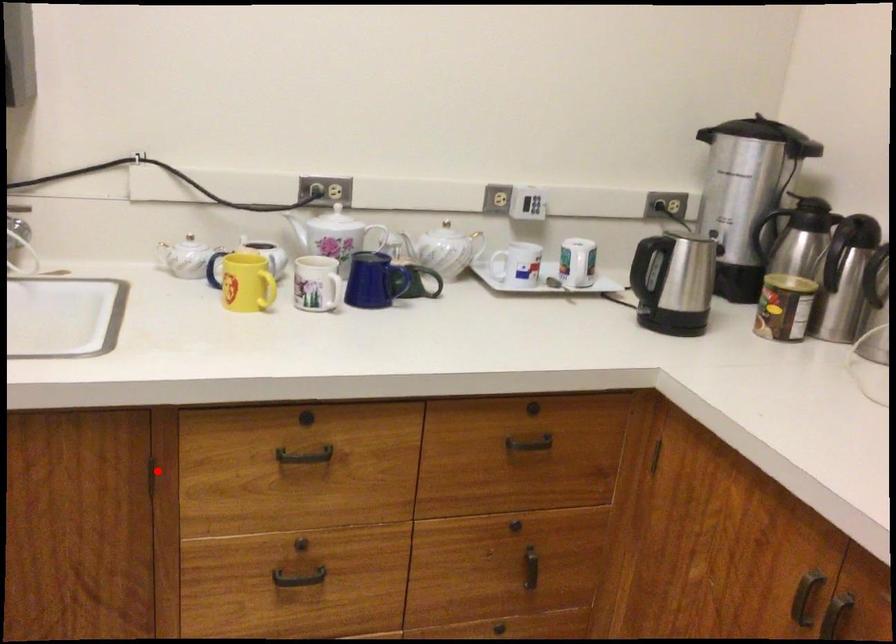
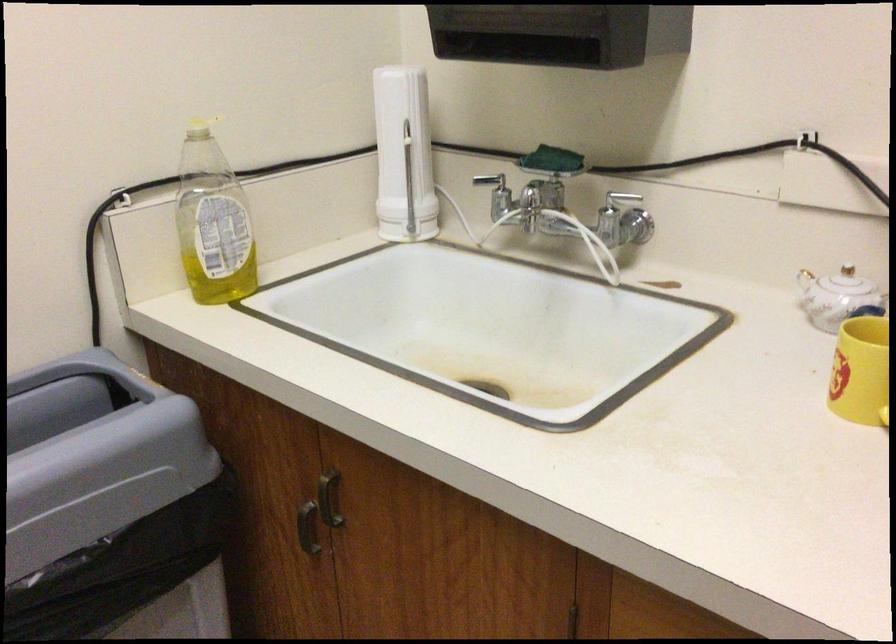
Question: I am providing you with two images of the same scene from different viewpoints. A red point is shown in image1. For the corresponding object point in image2, is it positioned nearer or farther from the camera?

Choices:
 (A) Nearer
 (B) Farther

Answer: (A)